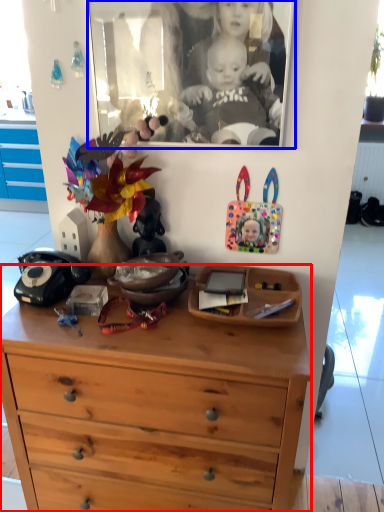
Question: Which object is further to the camera taking this photo, chest of drawers (highlighted by a red box) or picture frame (highlighted by a blue box)?

Choices:
 (A) chest of drawers
 (B) picture frame

Answer: (B)